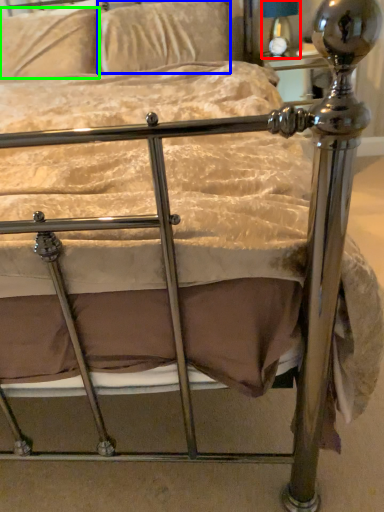
Question: Considering the real-world distances, which object is farthest from table lamp (highlighted by a red box)? pillow (highlighted by a blue box) or pillow (highlighted by a green box)?

Choices:
 (A) pillow
 (B) pillow

Answer: (B)